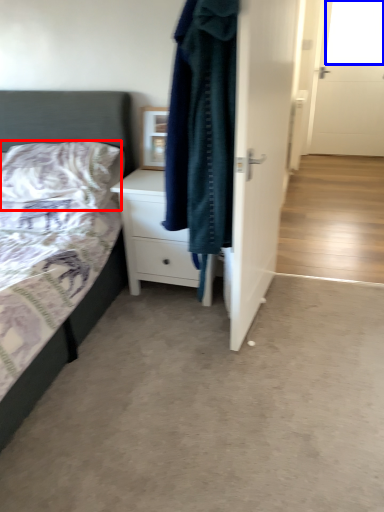
Question: Among these objects, which one is nearest to the camera, pillow (highlighted by a red box) or window screen (highlighted by a blue box)?

Choices:
 (A) pillow
 (B) window screen

Answer: (A)